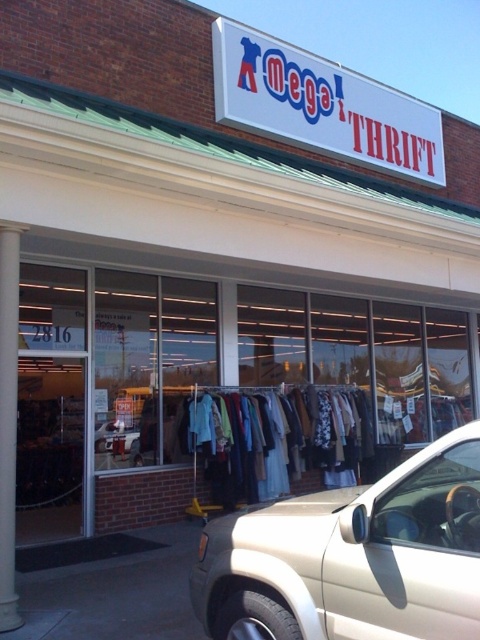
Between gold metallic suv at center and metallic gold suv at center, which one has less height?

metallic gold suv at center

Can you confirm if gold metallic suv at center is bigger than metallic gold suv at center?

Yes, gold metallic suv at center is bigger than metallic gold suv at center.

Measure the distance between point [269,582] and camera.

A distance of 10.09 feet exists between point [269,582] and camera.

Where is `gold metallic suv at center`? This screenshot has height=640, width=480. gold metallic suv at center is located at coordinates (352, 556).

Which is below, white smooth column at left or metallic gold suv at center?

metallic gold suv at center is lower down.

Is white smooth column at left taller than metallic gold suv at center?

Yes.

From the picture: Who is more distant from viewer, (12, 337) or (119, 429)?

Point (119, 429)

Where is `white smooth column at left`? Image resolution: width=480 pixels, height=640 pixels. white smooth column at left is located at coordinates (8, 420).

What do you see at coordinates (352, 556) in the screenshot?
I see `gold metallic suv at center` at bounding box center [352, 556].

Between gold metallic suv at center and white smooth column at left, which one appears on the left side from the viewer's perspective?

white smooth column at left

Is point (356, 586) in front of point (17, 305)?

Yes, point (356, 586) is closer to viewer.

Locate an element on the screen. The width and height of the screenshot is (480, 640). gold metallic suv at center is located at coordinates (352, 556).